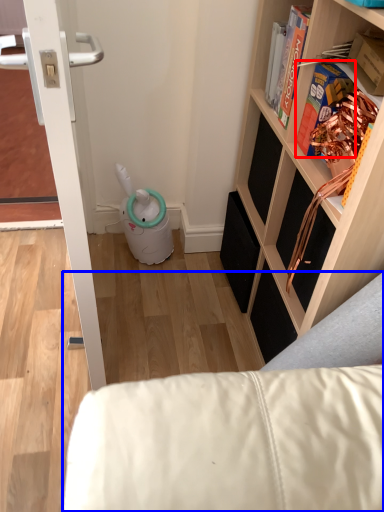
Question: Which point is closer to the camera, book (highlighted by a red box) or furniture (highlighted by a blue box)?

Choices:
 (A) book
 (B) furniture

Answer: (A)